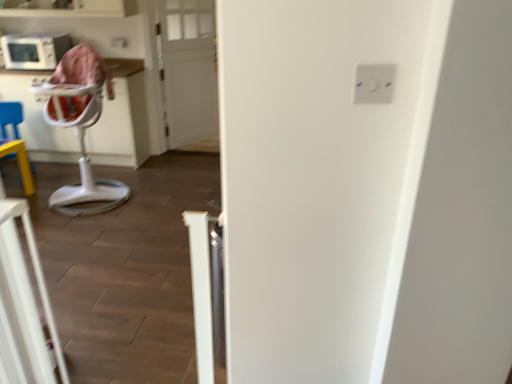
Question: Relative to white plastic electric outlet at upper right, is white wooden door at center in front or behind?

Choices:
 (A) behind
 (B) front

Answer: (A)

Question: Choose the correct answer: Is white wooden door at center inside white plastic electric outlet at upper right or outside it?

Choices:
 (A) outside
 (B) inside

Answer: (A)

Question: Which object is positioned farthest from the white plastic electric outlet at upper right?

Choices:
 (A) white plastic feeding chair at left
 (B) white wooden door at center
 (C) white plastic highchair at left

Answer: (B)

Question: Estimate the real-world distances between objects in this image. Which object is closer to the white plastic feeding chair at left?

Choices:
 (A) white wooden door at center
 (B) white plastic highchair at left
 (C) white plastic electric outlet at upper right

Answer: (A)